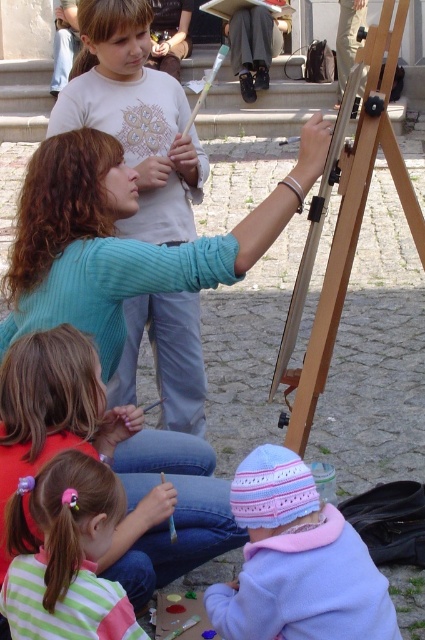
In the scene described, there are two objects of interest. The first is a striped cotton shirt at lower left, and the second is a pastel knit hat at lower center. From the perspective of an observer standing in front of the scene, which object is positioned to the right?

The pastel knit hat at lower center is positioned to the right of the striped cotton shirt at lower left.

You are a photographer trying to capture a photo of the striped cotton shirt at lower left and the pastel knit hat at lower center. Which object should you adjust your camera focus on first to ensure both are in the frame?

The pastel knit hat at lower center is behind the striped cotton shirt at lower left, so you should focus on the striped cotton shirt at lower left first to ensure both are in the frame.